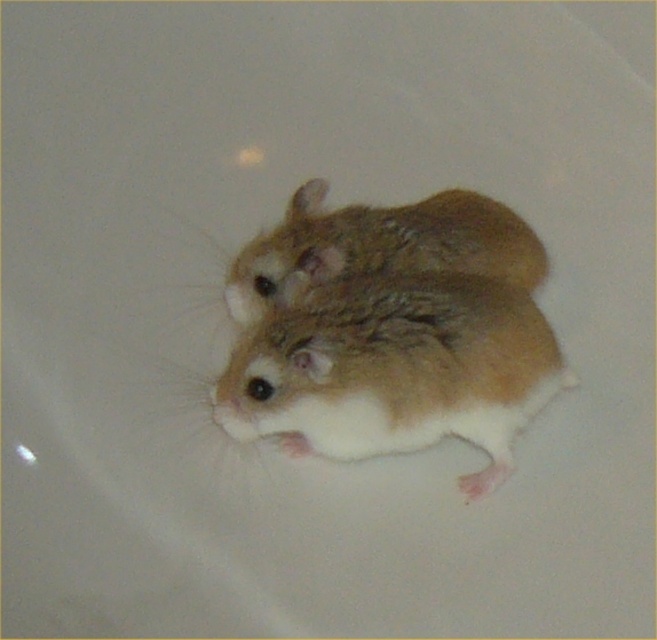
You are a veterinarian examining two small animals in an image. You see a fuzzy brown mouse at center and a fuzzy brown hamster at center. Which one is taller?

The fuzzy brown mouse at center is taller than the fuzzy brown hamster at center according to the description.

You are a veterinarian trying to determine if two rodents, a fuzzy brown mouse at center and a fuzzy brown hamster at center, can be placed in a cage that requires at least 5 inches of space between them. Based on the image, can they be placed in this cage?

The distance between the fuzzy brown mouse at center and the fuzzy brown hamster at center is 4.01 inches, which is less than the required 5 inches. Therefore, they cannot be placed in the cage with this spacing.

You are a veterinarian examining two small animals in an exam room. You see the fuzzy brown mouse at center and the fuzzy brown hamster at center. Which one is positioned lower in the image?

The fuzzy brown mouse at center is positioned lower than the fuzzy brown hamster at center according to the description.